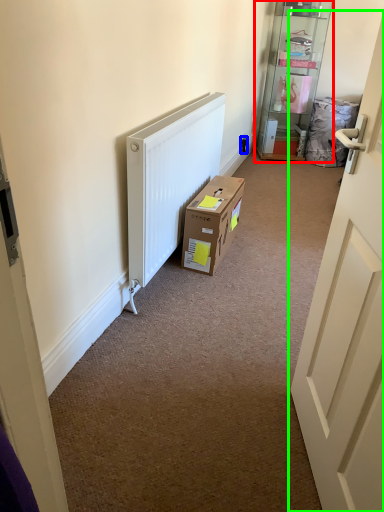
Question: Which object is positioned closest to shelf (highlighted by a red box)? Select from electric outlet (highlighted by a blue box) and door (highlighted by a green box).

Choices:
 (A) electric outlet
 (B) door

Answer: (A)